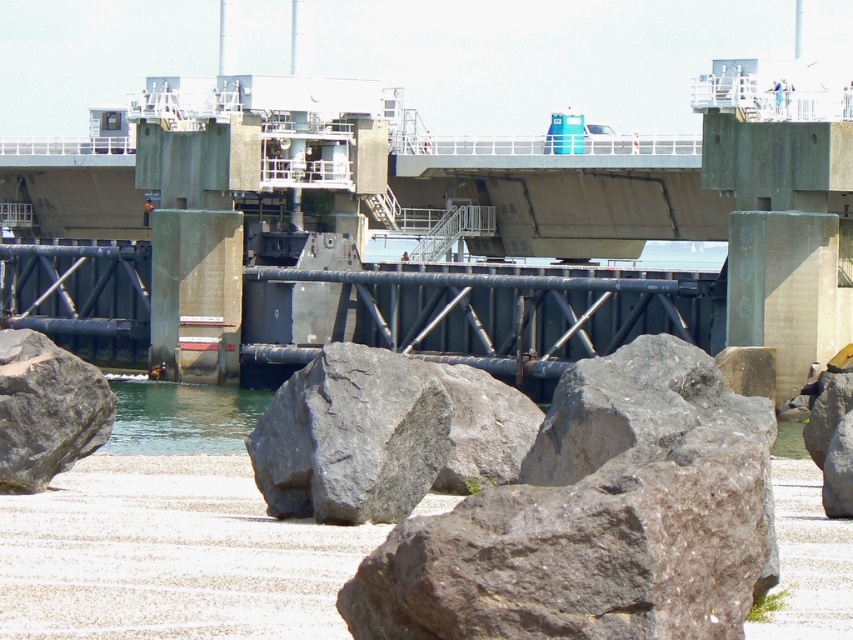
You are standing on the walkway and want to place a small potted plant between the gray rough rock at lower left and the gray rough rock at center. Can you do this without the plant being under either rock?

The gray rough rock at lower left is located above the gray rough rock at center, so there is space between them where the plant can be placed without being under either rock.

You are standing at the point marked by the coordinates point (351, 436) in the waterfront scene. Looking around, you notice a metal framework with a grid pattern in the midground and some gray rough stones in the foreground. Which object is closer to you at your current position?

The gray rough stone at center represented by point (351, 436) is at your current position, so it is the closest object to you.